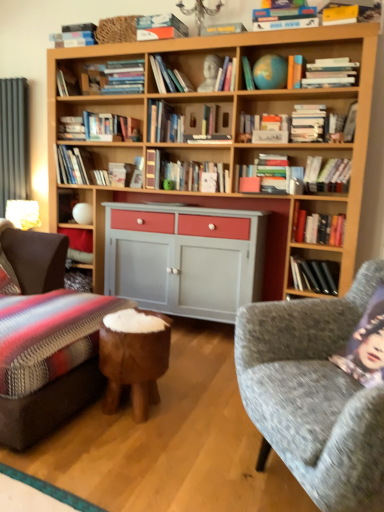
Locate an element on the screen. This screenshot has height=512, width=384. matte green book at center, which is counted as the 5th magazine, starting from the top is located at coordinates (265, 175).

The width and height of the screenshot is (384, 512). I want to click on yellow paper magazine at upper right, marked as the second magazine in a top-to-bottom arrangement, so pos(340,15).

Describe the element at coordinates (160, 27) in the screenshot. This screenshot has width=384, height=512. I see `matte white book at upper center, which appears as the 1th book when viewed from the top` at that location.

What is the approximate width of white matte magazine at center, the 2th magazine from the bottom?

white matte magazine at center, the 2th magazine from the bottom, is 5.48 inches in width.

What is the approximate height of white matte magazine at center, the 2th magazine from the bottom?

It is 24.18 centimeters.

You are a GUI agent. You are given a task and a screenshot of the screen. Output one action in this format:
    pyautogui.click(x=<x>, y=<y>)
    Task: Click on the hardcover books at left, the fourth book positioned from the bottom
    
    Given the screenshot: What is the action you would take?
    coord(73,165)

What do you see at coordinates (134, 366) in the screenshot? I see `polished wood stool at center` at bounding box center [134, 366].

Locate an element on the screen. This screenshot has width=384, height=512. polished wood stool at center is located at coordinates (134, 366).

Where is `hardcover book at upper center, arranged as the first magazine when viewed from the top`? hardcover book at upper center, arranged as the first magazine when viewed from the top is located at coordinates (284, 18).

Is yellow paper magazine at upper right, the fourth magazine from the bottom, with hardcover book at upper center, arranged as the first magazine when viewed from the top?

No, yellow paper magazine at upper right, the fourth magazine from the bottom, is not in contact with hardcover book at upper center, arranged as the first magazine when viewed from the top.

Between yellow paper magazine at upper right, the fourth magazine from the bottom, and hardcover book at upper center, which is the 5th magazine from bottom to top, which one has less height?

yellow paper magazine at upper right, the fourth magazine from the bottom.

From a real-world perspective, relative to hardcover book at upper center, arranged as the first magazine when viewed from the top, is yellow paper magazine at upper right, the fourth magazine from the bottom, vertically above or below?

From a real-world perspective, yellow paper magazine at upper right, the fourth magazine from the bottom, is physically below hardcover book at upper center, arranged as the first magazine when viewed from the top.

Is yellow paper magazine at upper right, marked as the second magazine in a top-to-bottom arrangement, thinner than hardcover book at upper center, which is the 5th magazine from bottom to top?

Yes, yellow paper magazine at upper right, marked as the second magazine in a top-to-bottom arrangement, is thinner than hardcover book at upper center, which is the 5th magazine from bottom to top.

In terms of width, does white matte book at center, which appears as the 3th book when ordered from the bottom, look wider or thinner when compared to black hardcover books at center-right, which is the 4th book from left to right?

Considering their sizes, white matte book at center, which appears as the 3th book when ordered from the bottom, looks slimmer than black hardcover books at center-right, which is the 4th book from left to right.

Image resolution: width=384 pixels, height=512 pixels. I want to click on the 2nd book counting from the left side of the white matte book at center, which appears as the 1th book when viewed from the right, so click(x=314, y=275).

Does white matte book at center, which appears as the 1th book when viewed from the right, lie in front of black hardcover books at center-right, which is counted as the first book, starting from the bottom?

Yes, the depth of white matte book at center, which appears as the 1th book when viewed from the right, is less than that of black hardcover books at center-right, which is counted as the first book, starting from the bottom.

Does point (325, 180) appear closer or farther from the camera than point (318, 261)?

Point (325, 180).

Between hardcover book at upper center, arranged as the first magazine when viewed from the top, and hardcover book at upper right, the 3th magazine viewed from the top, which one has more height?

Standing taller between the two is hardcover book at upper right, the 3th magazine viewed from the top.

Is there a large distance between hardcover book at upper center, which is the 5th magazine from bottom to top, and hardcover book at upper right, acting as the 3th magazine starting from the bottom?

No.

Which object is thinner, hardcover book at upper center, which is the 5th magazine from bottom to top, or hardcover book at upper right, the 3th magazine viewed from the top?

hardcover book at upper right, the 3th magazine viewed from the top.

Which is correct: hardcover book at upper center, arranged as the first magazine when viewed from the top, is inside hardcover book at upper right, the 3th magazine viewed from the top, or outside of it?

The correct answer is: outside.

Is polished wood stool at center not inside matte green book at center, which is counted as the 5th magazine, starting from the top?

Yes, polished wood stool at center is located beyond the bounds of matte green book at center, which is counted as the 5th magazine, starting from the top.

Is polished wood stool at center touching matte green book at center, which is counted as the 5th magazine, starting from the top?

polished wood stool at center and matte green book at center, which is counted as the 5th magazine, starting from the top, are not in contact.

Between point (134, 398) and point (267, 184), which one is positioned behind?

The point (267, 184) is farther from the camera.

Does polished wood stool at center have a greater width compared to matte green book at center, the first magazine ordered from the bottom?

Yes, polished wood stool at center is wider than matte green book at center, the first magazine ordered from the bottom.

Is point (138, 406) farther from viewer compared to point (325, 15)?

No, it is in front of (325, 15).

Can you confirm if polished wood stool at center is bigger than yellow paper magazine at upper right, marked as the second magazine in a top-to-bottom arrangement?

Yes, polished wood stool at center is bigger than yellow paper magazine at upper right, marked as the second magazine in a top-to-bottom arrangement.

From a real-world perspective, is polished wood stool at center physically above yellow paper magazine at upper right, marked as the second magazine in a top-to-bottom arrangement?

Incorrect, from a real-world perspective, polished wood stool at center is lower than yellow paper magazine at upper right, marked as the second magazine in a top-to-bottom arrangement.

Is polished wood stool at center in front of or behind yellow paper magazine at upper right, the fourth magazine from the bottom, in the image?

Clearly, polished wood stool at center is in front of yellow paper magazine at upper right, the fourth magazine from the bottom.

Is matte green book at center, the first magazine ordered from the bottom, oriented towards white matte magazine at center, the 2th magazine from the bottom?

No, matte green book at center, the first magazine ordered from the bottom, is not aimed at white matte magazine at center, the 2th magazine from the bottom.

Which is more to the right, matte green book at center, the first magazine ordered from the bottom, or white matte magazine at center, the 2th magazine from the bottom?

matte green book at center, the first magazine ordered from the bottom.

Considering the relative sizes of matte green book at center, which is counted as the 5th magazine, starting from the top, and white matte magazine at center, the 2th magazine from the bottom, in the image provided, is matte green book at center, which is counted as the 5th magazine, starting from the top, shorter than white matte magazine at center, the 2th magazine from the bottom,?

In fact, matte green book at center, which is counted as the 5th magazine, starting from the top, may be taller than white matte magazine at center, the 2th magazine from the bottom.

From the image's perspective, which object appears higher, matte green book at center, which is counted as the 5th magazine, starting from the top, or white matte magazine at center, the 2th magazine from the bottom?

white matte magazine at center, the 2th magazine from the bottom, from the image's perspective.

Which object is positioned more to the left, green matte globe at upper center, which is the fourth book in right-to-left order, or white matte book at center, which appears as the 1th book when viewed from the right?

Positioned to the left is green matte globe at upper center, which is the fourth book in right-to-left order.

Considering the sizes of green matte globe at upper center, which is counted as the 5th book, starting from the bottom, and white matte book at center, the fourth book positioned from the top, in the image, is green matte globe at upper center, which is counted as the 5th book, starting from the bottom, wider or thinner than white matte book at center, the fourth book positioned from the top,?

Clearly, green matte globe at upper center, which is counted as the 5th book, starting from the bottom, has more width compared to white matte book at center, the fourth book positioned from the top.

Is green matte globe at upper center, which is counted as the 5th book, starting from the bottom, bigger or smaller than white matte book at center, the fourth book positioned from the top?

In the image, green matte globe at upper center, which is counted as the 5th book, starting from the bottom, appears to be smaller than white matte book at center, the fourth book positioned from the top.

From a real-world perspective, which object rests below the other?

From a 3D spatial view, white matte book at center, the fourth book positioned from the top, is below.

From the yellow paper magazine at upper right, the fourth magazine from the bottom, count 2nd magazines backward and point to it. Please provide its 2D coordinates.

[(284, 18)]

From a real-world perspective, starting from the black hardcover books at center-right, which is counted as the first book, starting from the bottom, which book is the 3rd one vertically above it? Please provide its 2D coordinates.

[(327, 175)]

Looking at the image, which one is located further to white matte magazine at center, the fourth magazine in the top-to-bottom sequence, hardcover book at upper center, arranged as the first magazine when viewed from the top, or matte white book at upper center, which is counted as the 2th book, starting from the left?

matte white book at upper center, which is counted as the 2th book, starting from the left, is positioned further to the anchor white matte magazine at center, the fourth magazine in the top-to-bottom sequence.

Based on their spatial positions, is polished wood stool at center or hardcover book at upper right, the 3th magazine viewed from the top, further from yellow paper magazine at upper right, the fourth magazine from the bottom?

Among the two, polished wood stool at center is located further to yellow paper magazine at upper right, the fourth magazine from the bottom.

Estimate the real-world distances between objects in this image. Which object is further from matte white book at upper center, the sixth book in the bottom-to-top sequence, white matte magazine at center, the fourth magazine in the top-to-bottom sequence, or hardcover books at right, marked as the second book in a right-to-left arrangement?

Among the two, hardcover books at right, marked as the second book in a right-to-left arrangement, is located further to matte white book at upper center, the sixth book in the bottom-to-top sequence.

Considering their positions, is green matte globe at upper center, which is the fourth book in right-to-left order, positioned closer to matte green book at center, which is counted as the 5th magazine, starting from the top, than black hardcover books at center-right, which is counted as the first book, starting from the bottom?

The object closer to matte green book at center, which is counted as the 5th magazine, starting from the top, is green matte globe at upper center, which is the fourth book in right-to-left order.

Looking at the image, which one is located further to hardcover books at right, marked as the second book in a right-to-left arrangement, white matte magazine at center, the fourth magazine in the top-to-bottom sequence, or hardcover books at left, which ranks as the third book in top-to-bottom order?

Based on the image, hardcover books at left, which ranks as the third book in top-to-bottom order, appears to be further to hardcover books at right, marked as the second book in a right-to-left arrangement.

Which object lies further to the anchor point black hardcover books at center-right, which is the 4th book from left to right, green matte globe at upper center, the 3th book in the left-to-right sequence, or matte gold table lamp at left?

matte gold table lamp at left.

In the scene shown: When comparing their distances from polished wood stool at center, does hardcover book at upper right, the 3th magazine viewed from the top, or matte gold table lamp at left seem closer?

hardcover book at upper right, the 3th magazine viewed from the top, is positioned closer to the anchor polished wood stool at center.

Which object lies nearer to the anchor point matte gold table lamp at left, polished wood stool at center or hardcover book at upper center, arranged as the first magazine when viewed from the top?

Based on the image, polished wood stool at center appears to be nearer to matte gold table lamp at left.

Find the location of a particular element. stool situated between matte gold table lamp at left and black hardcover books at center-right, which ranks as the sixth book in top-to-bottom order, from left to right is located at coordinates (134, 366).

Identify the location of stool between matte gold table lamp at left and green matte globe at upper center, which is the fourth book in right-to-left order, in the horizontal direction. (134, 366).

At what (x,y) coordinates should I click in order to perform the action: click on stool between textured gray fabric couch at lower right and white matte book at center, which appears as the 3th book when ordered from the bottom, from front to back. Please return your answer as a coordinate pair (x, y). The height and width of the screenshot is (512, 384). Looking at the image, I should click on (134, 366).

Where is `stool situated between hardcover books at left, the fourth book positioned from the bottom, and hardcover books at right, arranged as the 5th book when viewed from the top, from left to right`? This screenshot has height=512, width=384. stool situated between hardcover books at left, the fourth book positioned from the bottom, and hardcover books at right, arranged as the 5th book when viewed from the top, from left to right is located at coordinates (134, 366).